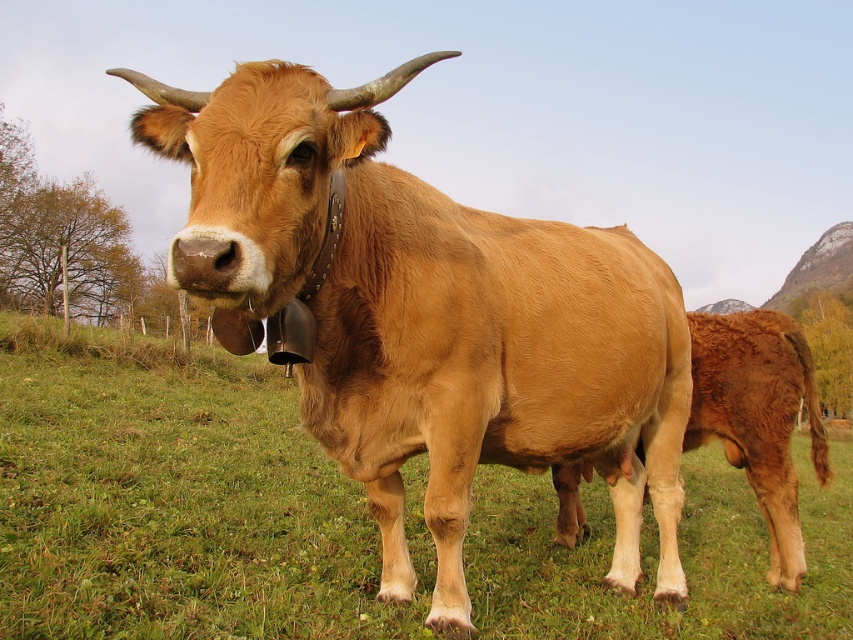
Can you confirm if shiny brown cow at center is positioned below brown smooth cow at lower right?

No.

Does shiny brown cow at center have a smaller size compared to brown smooth cow at lower right?

No, shiny brown cow at center is not smaller than brown smooth cow at lower right.

You are a GUI agent. You are given a task and a screenshot of the screen. Output one action in this format:
    pyautogui.click(x=<x>, y=<y>)
    Task: Click on the shiny brown cow at center
    This screenshot has height=640, width=853.
    Given the screenshot: What is the action you would take?
    pyautogui.click(x=430, y=314)

From the picture: Which is more to the left, green grass at center or shiny brown cow at center?

shiny brown cow at center

Is point (419, 560) closer to camera compared to point (322, 198)?

That is False.

At what (x,y) coordinates should I click in order to perform the action: click on green grass at center. Please return your answer as a coordinate pair (x, y). The image size is (853, 640). Looking at the image, I should click on (178, 499).

Is green grass at center wider than brown smooth cow at lower right?

Yes.

Who is positioned more to the left, green grass at center or brown smooth cow at lower right?

From the viewer's perspective, green grass at center appears more on the left side.

Locate an element on the screen. The width and height of the screenshot is (853, 640). green grass at center is located at coordinates (178, 499).